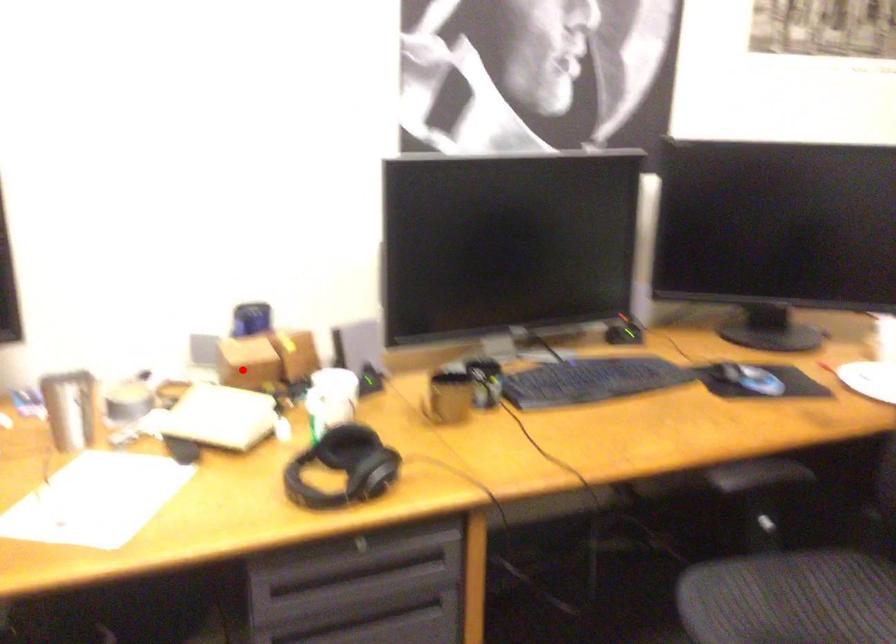
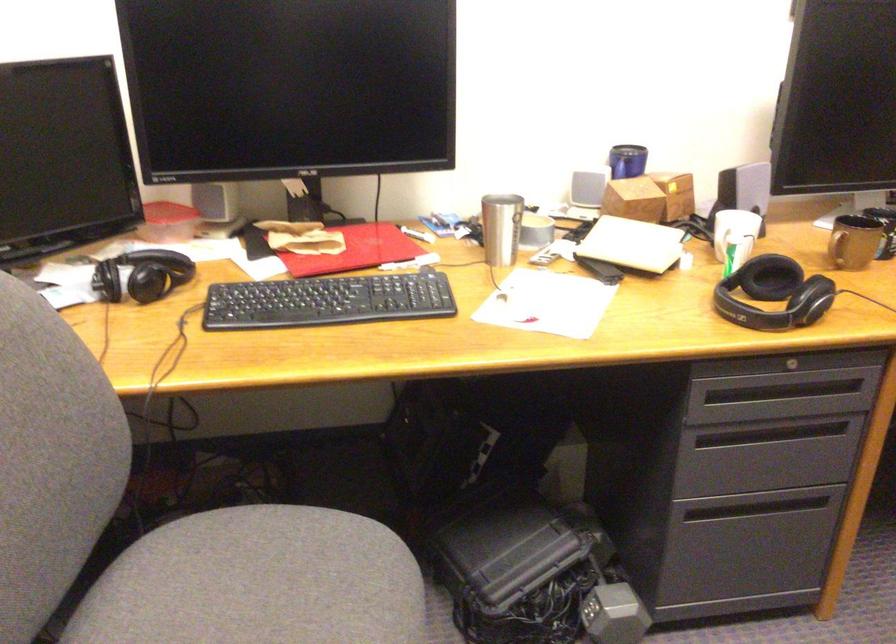
Locate, in the second image, the point that corresponds to the highlighted location in the first image.

(633, 200)